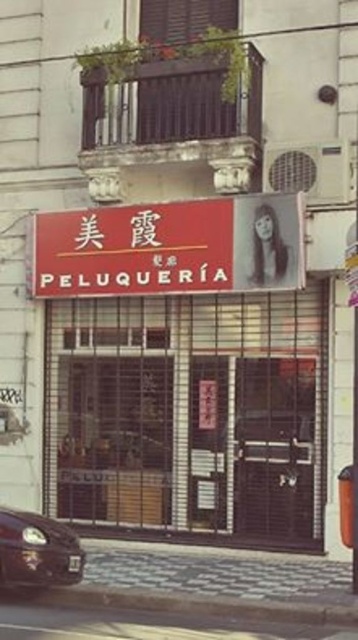
Question: Which object appears closest to the camera in this image?

Choices:
 (A) shiny black car at lower left
 (B) matte red sign at center
 (C) gray concrete curb at lower center

Answer: (C)

Question: Among these points, which one is nearest to the camera?

Choices:
 (A) (216, 609)
 (B) (167, 269)

Answer: (A)

Question: Is gray concrete curb at lower center wider than shiny black car at lower left?

Choices:
 (A) no
 (B) yes

Answer: (B)

Question: Is matte red sign at center thinner than shiny black car at lower left?

Choices:
 (A) no
 (B) yes

Answer: (A)

Question: Can you confirm if matte red sign at center is positioned to the right of shiny black car at lower left?

Choices:
 (A) no
 (B) yes

Answer: (B)

Question: Among these objects, which one is nearest to the camera?

Choices:
 (A) matte red sign at center
 (B) shiny black car at lower left

Answer: (B)